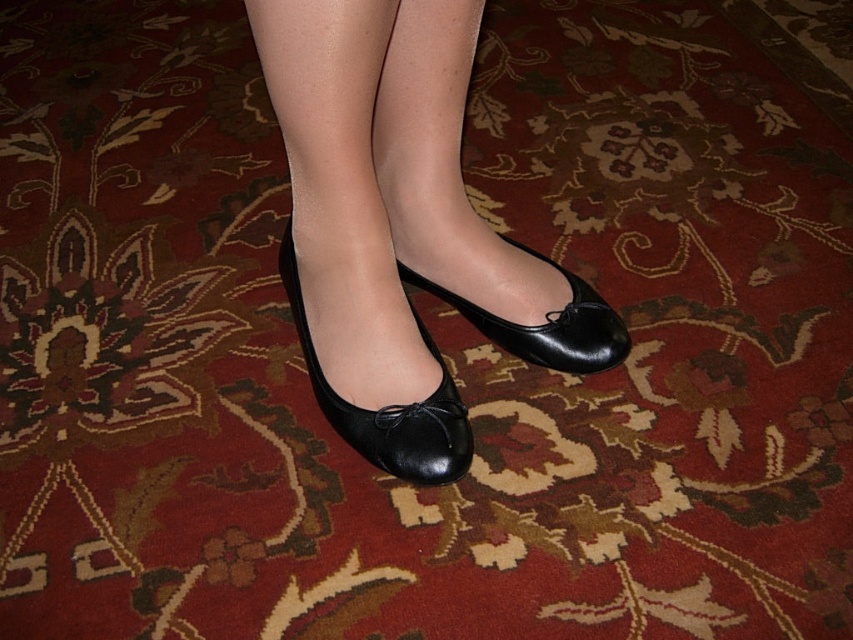
Who is lower down, black leather shoes at center or black leather shoe at center?

black leather shoe at center is below.

How far apart are black leather shoes at center and black leather shoe at center?

black leather shoes at center is 10.42 centimeters away from black leather shoe at center.

Which is in front, point (363, 172) or point (352, 410)?

Positioned in front is point (363, 172).

The height and width of the screenshot is (640, 853). Identify the location of black leather shoes at center. (401, 227).

This screenshot has width=853, height=640. I want to click on black leather shoes at center, so click(x=401, y=227).

Is point (479, 257) less distant than point (556, 368)?

No, (479, 257) is behind (556, 368).

Is point (396, 160) positioned in front of point (611, 352)?

That is False.

At what (x,y) coordinates should I click in order to perform the action: click on black leather shoes at center. Please return your answer as a coordinate pair (x, y). Image resolution: width=853 pixels, height=640 pixels. Looking at the image, I should click on (401, 227).

Is point (358, 432) less distant than point (447, 298)?

Yes, point (358, 432) is in front of point (447, 298).

Can you confirm if black leather shoe at center is wider than shiny black shoe at center?

No.

The width and height of the screenshot is (853, 640). Identify the location of black leather shoe at center. (387, 406).